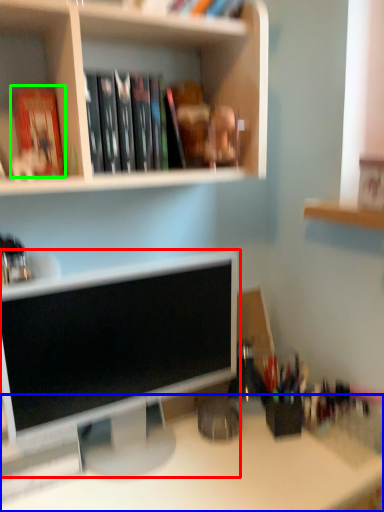
Question: Based on their relative distances, which object is farther from computer monitor (highlighted by a red box)? Choose from desk (highlighted by a blue box) and paperback book (highlighted by a green box).

Choices:
 (A) desk
 (B) paperback book

Answer: (B)